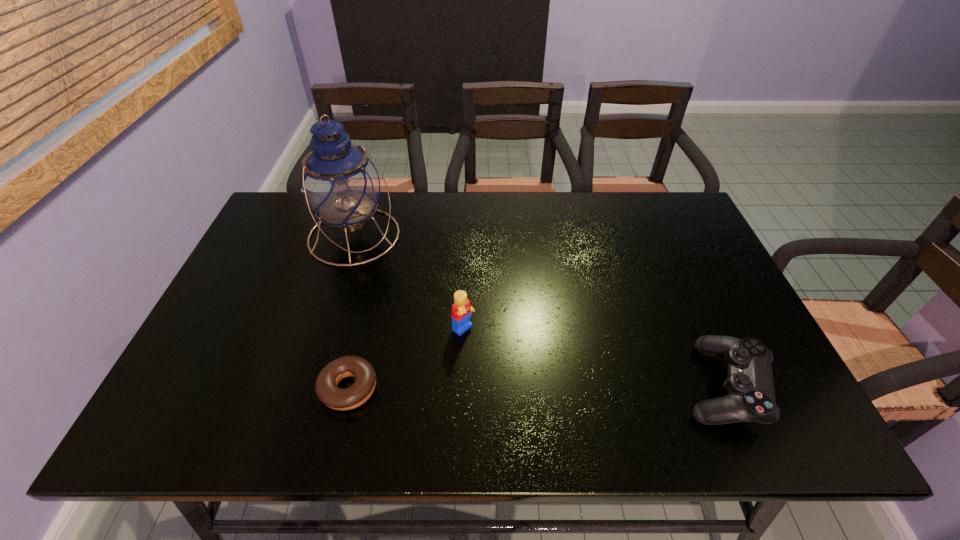
Identify the location of object at the far left corner. (339, 183).

At what (x,y) coordinates should I click in order to perform the action: click on object located at the near right corner. Please return your answer as a coordinate pair (x, y). Looking at the image, I should click on (750, 386).

Find the location of `vacant space at the far edge of the desktop`. vacant space at the far edge of the desktop is located at coordinates (546, 202).

Find the location of a particular element. This screenshot has width=960, height=540. vacant space at the near edge is located at coordinates (414, 380).

The image size is (960, 540). I want to click on vacant point at the left edge, so click(x=215, y=353).

At what (x,y) coordinates should I click in order to perform the action: click on vacant area at the right edge of the desktop. Please return your answer as a coordinate pair (x, y). Image resolution: width=960 pixels, height=540 pixels. Looking at the image, I should click on (712, 254).

The image size is (960, 540). What are the coordinates of `vacant area at the near left corner of the desktop` in the screenshot? It's located at (234, 372).

The image size is (960, 540). In the image, there is a desktop. In order to click on free space at the far right corner in this screenshot , I will do `click(643, 210)`.

The height and width of the screenshot is (540, 960). What are the coordinates of `vacant space at the near right corner of the desktop` in the screenshot? It's located at (714, 396).

Image resolution: width=960 pixels, height=540 pixels. What are the coordinates of `free space between the shortest object and the third object from left to right` in the screenshot? It's located at (406, 359).